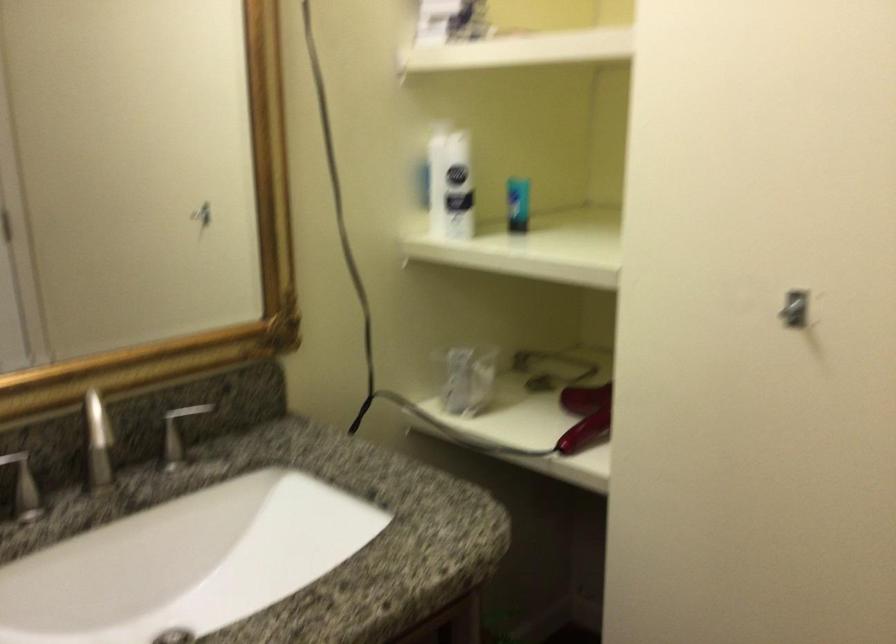
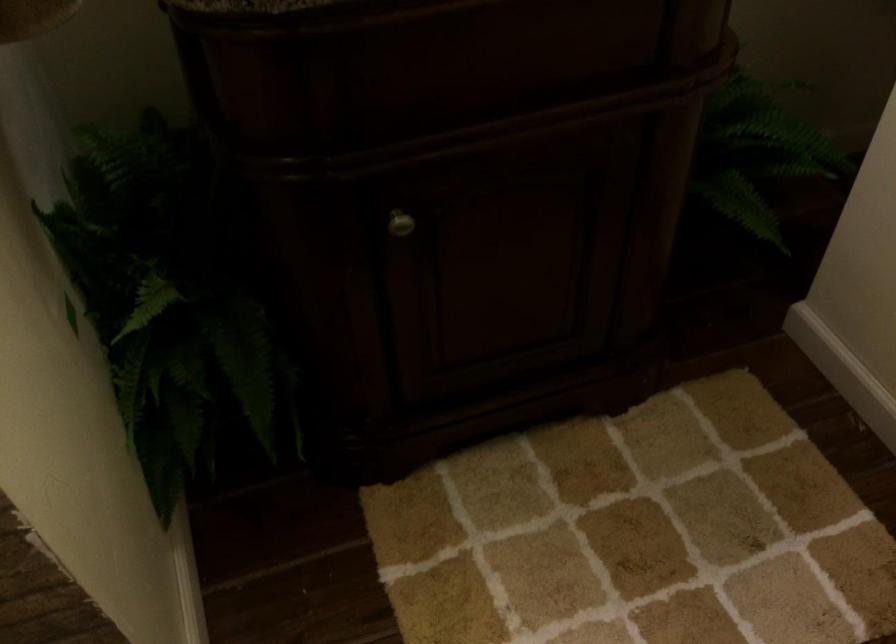
The first image is from the beginning of the video and the second image is from the end. How did the camera likely rotate when shooting the video?

The camera rotated toward left-down.